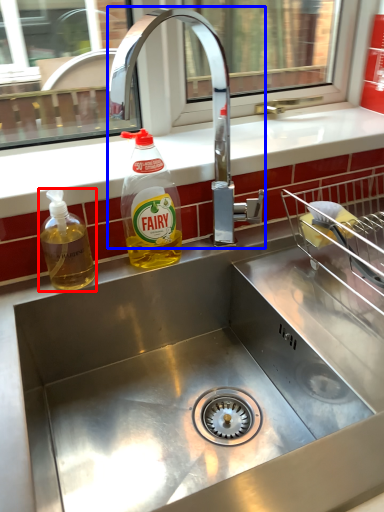
Question: Which object appears closest to the camera in this image, bottle (highlighted by a red box) or tap (highlighted by a blue box)?

Choices:
 (A) bottle
 (B) tap

Answer: (B)